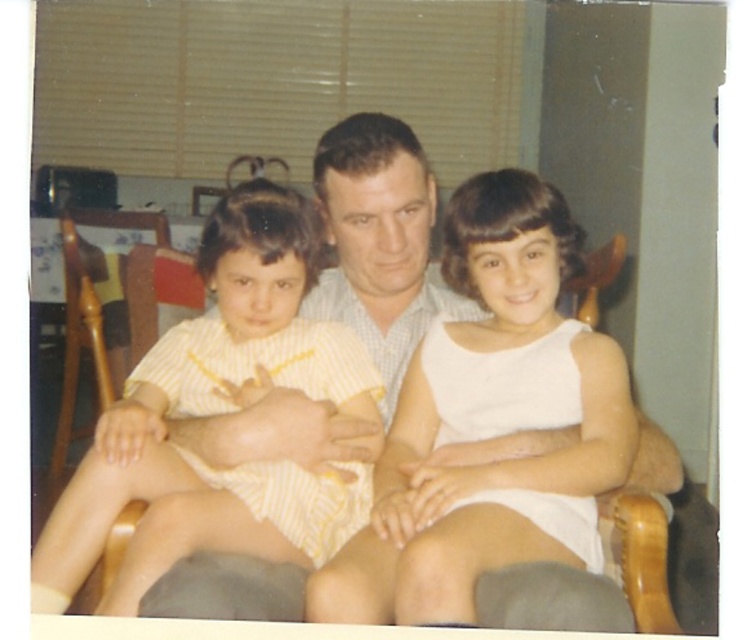
Question: Which object appears farthest from the camera in this image?

Choices:
 (A) wooden rocking chair at left
 (B) yellow striped fabric at left
 (C) white satin dress at center

Answer: (A)

Question: In this image, where is white satin dress at center located relative to wooden rocking chair at left?

Choices:
 (A) left
 (B) right

Answer: (B)

Question: Which of the following is the farthest from the observer?

Choices:
 (A) (155, 301)
 (B) (137, 221)
 (C) (51, 532)
 (D) (551, 390)

Answer: (B)

Question: Can you confirm if yellow striped fabric at left is positioned below wooden rocking chair at left?

Choices:
 (A) no
 (B) yes

Answer: (B)

Question: Which object is the closest to the white satin dress at center?

Choices:
 (A) wooden rocking chair at left
 (B) yellow striped fabric at left
 (C) white fabric dress at center

Answer: (B)

Question: Can you confirm if white fabric dress at center is smaller than wooden rocking chair at left?

Choices:
 (A) yes
 (B) no

Answer: (B)